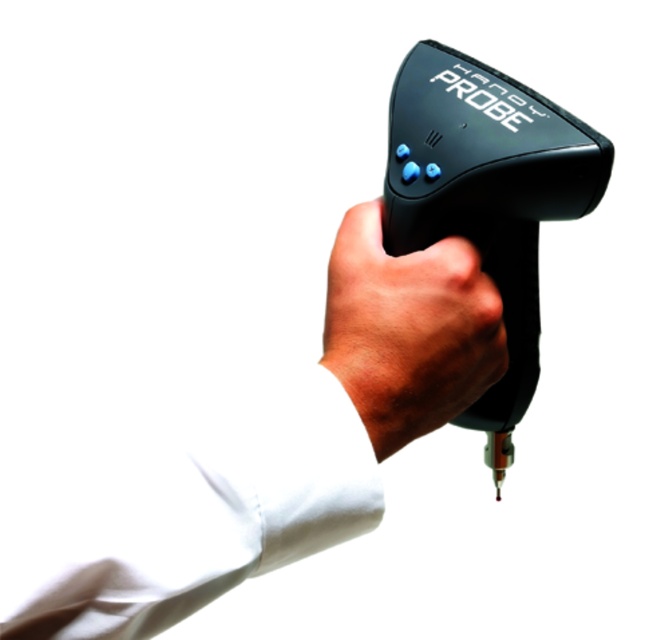
Question: Which object is the closest to the black matte probe at center?

Choices:
 (A) matte black probe at center
 (B) black rubber probe at center

Answer: (A)

Question: Does black matte probe at center have a greater width compared to black rubber probe at center?

Choices:
 (A) no
 (B) yes

Answer: (B)

Question: Which point is closer to the camera?

Choices:
 (A) (349, 314)
 (B) (235, 531)

Answer: (B)

Question: Does black matte probe at center appear on the right side of matte black probe at center?

Choices:
 (A) no
 (B) yes

Answer: (A)

Question: Does black rubber probe at center appear under matte black probe at center?

Choices:
 (A) yes
 (B) no

Answer: (B)

Question: Among these points, which one is nearest to the camera?

Choices:
 (A) (349, 346)
 (B) (240, 490)

Answer: (B)